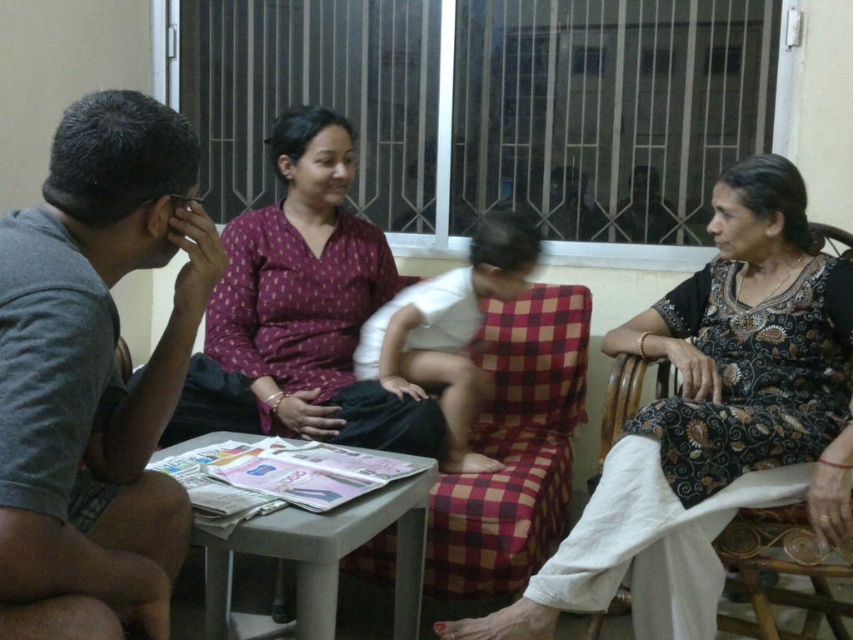
You are standing in the living room and want to locate the gray cotton shirt at left. According to the coordinates provided, where would you find it?

The gray cotton shirt at left is located at the 2D coordinates point (97, 358).

You are standing in the living room and want to place a small potted plant between the two points labeled point (73, 440) and point (451, 378). Based on their positions, which point should the plant be closer to?

The plant should be placed closer to point (451, 378) because point (73, 440) is in front of it, meaning it is closer to you. To place the plant between them, it needs to be closer to the farther point.

You are standing in the living room and want to take a photo of the point at coordinates point (62, 211). Can you estimate how far you need to walk forward to get the point in focus?

The point (62, 211) is 3.71 feet from the camera, so you need to walk forward approximately 3.71 feet to get it in focus.